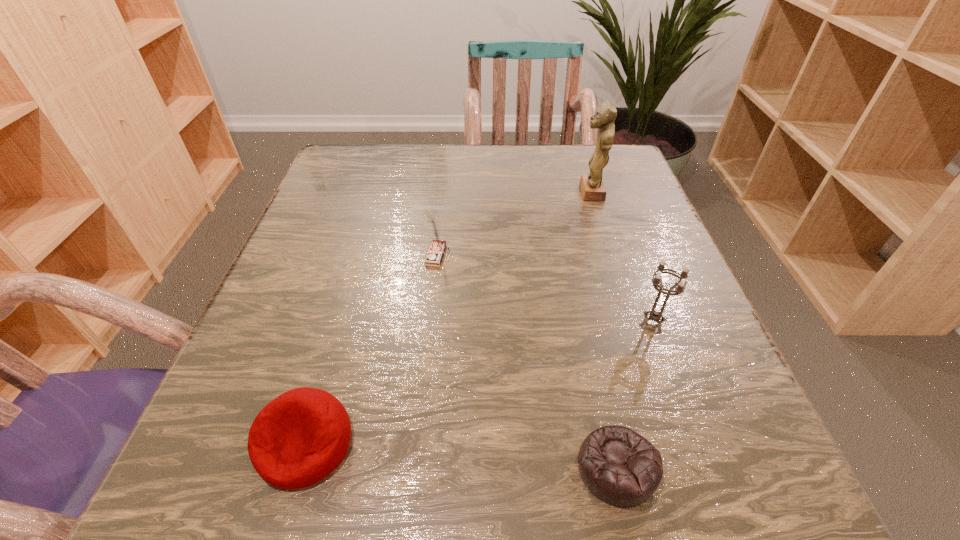
Locate an element on the screen. Image resolution: width=960 pixels, height=540 pixels. object that is the third closest to the candle holder is located at coordinates (435, 253).

Where is `object that stands as the second closest to the tallest object`? This screenshot has width=960, height=540. object that stands as the second closest to the tallest object is located at coordinates (654, 315).

The image size is (960, 540). I want to click on free point that satisfies the following two spatial constraints: 1. on the seat area of the right beanbag; 2. on the left side of the leftmost object, so click(299, 468).

The height and width of the screenshot is (540, 960). I want to click on vacant space that satisfies the following two spatial constraints: 1. on the back side of the right beanbag; 2. on the right side of the third nearest object, so click(x=585, y=322).

Image resolution: width=960 pixels, height=540 pixels. I want to click on vacant region that satisfies the following two spatial constraints: 1. on the front-facing side of the figurine; 2. on the back side of the candle holder, so pos(632,322).

In order to click on free space that satisfies the following two spatial constraints: 1. on the front-facing side of the farthest object; 2. on the right side of the third nearest object in this screenshot , I will do `click(632, 322)`.

Identify the location of blank space that satisfies the following two spatial constraints: 1. on the front-facing side of the third farthest object; 2. on the left side of the figurine. (632, 322).